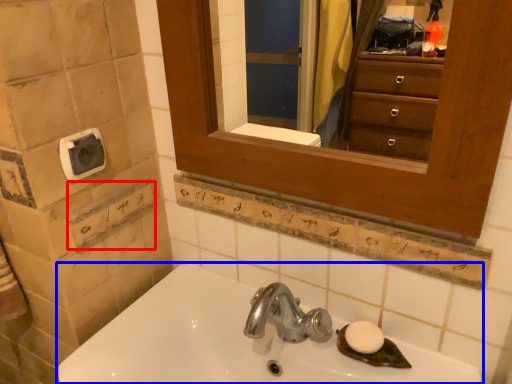
Question: Among these objects, which one is nearest to the camera, square (highlighted by a red box) or sink (highlighted by a blue box)?

Choices:
 (A) square
 (B) sink

Answer: (B)